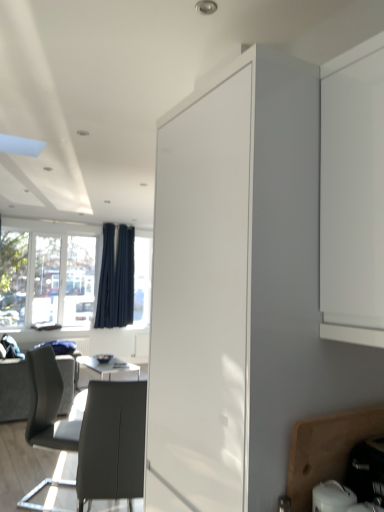
Question: Is white glossy cabinet at center, which appears as the 1th cabinetry when viewed from the top, closer to camera compared to dark blue fabric curtain at left, which ranks as the 1th curtain in right-to-left order?

Choices:
 (A) yes
 (B) no

Answer: (A)

Question: Does white glossy cabinet at center, which appears as the 1th cabinetry when viewed from the top, have a greater height compared to dark blue fabric curtain at left, which ranks as the 1th curtain in right-to-left order?

Choices:
 (A) yes
 (B) no

Answer: (B)

Question: Can you confirm if white glossy cabinet at center, which is counted as the second cabinetry, starting from the bottom, is bigger than dark blue fabric curtain at left, arranged as the 2th curtain when viewed from the left?

Choices:
 (A) yes
 (B) no

Answer: (A)

Question: Is white glossy cabinet at center, which appears as the 1th cabinetry when viewed from the top, smaller than dark blue fabric curtain at left, arranged as the 2th curtain when viewed from the left?

Choices:
 (A) no
 (B) yes

Answer: (A)

Question: Is white glossy cabinet at center, which appears as the 1th cabinetry when viewed from the top, not close to dark blue fabric curtain at left, arranged as the 2th curtain when viewed from the left?

Choices:
 (A) no
 (B) yes

Answer: (B)

Question: From a real-world perspective, is white glossy cabinet at center, which appears as the 1th cabinetry when viewed from the top, over dark blue fabric curtain at left, which ranks as the 1th curtain in right-to-left order?

Choices:
 (A) no
 (B) yes

Answer: (A)

Question: From a real-world perspective, is dark blue fabric curtain at left, arranged as the first curtain when viewed from the left, located higher than dark blue fabric curtain at left, arranged as the 2th curtain when viewed from the left?

Choices:
 (A) yes
 (B) no

Answer: (A)

Question: Is dark blue fabric curtain at left, which is the second curtain in right-to-left order, not close to dark blue fabric curtain at left, arranged as the 2th curtain when viewed from the left?

Choices:
 (A) yes
 (B) no

Answer: (B)

Question: Is dark blue fabric curtain at left, which is the second curtain in right-to-left order, positioned with its back to dark blue fabric curtain at left, arranged as the 2th curtain when viewed from the left?

Choices:
 (A) no
 (B) yes

Answer: (A)

Question: Does dark blue fabric curtain at left, which is the second curtain in right-to-left order, appear on the left side of dark blue fabric curtain at left, arranged as the 2th curtain when viewed from the left?

Choices:
 (A) yes
 (B) no

Answer: (A)

Question: Is dark blue fabric curtain at left, which ranks as the 1th curtain in right-to-left order, surrounded by dark blue fabric curtain at left, which is the second curtain in right-to-left order?

Choices:
 (A) yes
 (B) no

Answer: (B)

Question: From the image's perspective, is dark blue fabric curtain at left, which is the second curtain in right-to-left order, located beneath dark blue fabric curtain at left, which ranks as the 1th curtain in right-to-left order?

Choices:
 (A) yes
 (B) no

Answer: (B)

Question: From a real-world perspective, is dark blue fabric curtain at left, arranged as the first curtain when viewed from the left, on wooden cutting board at lower right, which is the first cabinetry from bottom to top?

Choices:
 (A) yes
 (B) no

Answer: (A)